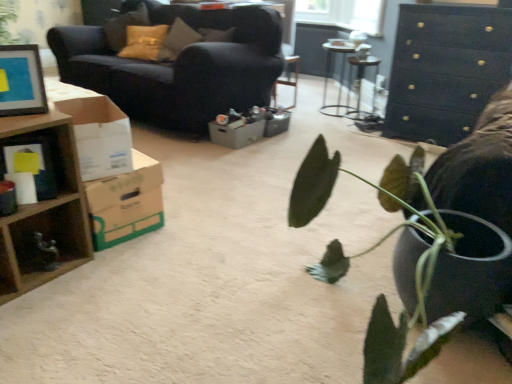
Question: From a real-world perspective, is gray cardboard box at center, the first cardboard box when ordered from back to front, positioned over metallic silver table at center, the 2th table positioned from the left, based on gravity?

Choices:
 (A) yes
 (B) no

Answer: (B)

Question: Considering the relative sizes of gray cardboard box at center, the first cardboard box when ordered from back to front, and metallic silver table at center, the 2th table positioned from the left, in the image provided, is gray cardboard box at center, the first cardboard box when ordered from back to front, shorter than metallic silver table at center, the 2th table positioned from the left,?

Choices:
 (A) no
 (B) yes

Answer: (B)

Question: Is gray cardboard box at center, which ranks as the third cardboard box in front-to-back order, next to metallic silver table at center, which ranks as the 1th table in right-to-left order, and touching it?

Choices:
 (A) yes
 (B) no

Answer: (B)

Question: Does gray cardboard box at center, the first cardboard box when ordered from back to front, lie behind metallic silver table at center, which ranks as the 1th table in right-to-left order?

Choices:
 (A) no
 (B) yes

Answer: (A)

Question: Can you confirm if gray cardboard box at center, which ranks as the third cardboard box in front-to-back order, is positioned to the right of metallic silver table at center, which ranks as the 1th table in right-to-left order?

Choices:
 (A) no
 (B) yes

Answer: (A)

Question: From a real-world perspective, is white cardboard box at left, the third cardboard box when ordered from back to front, positioned above or below matte black picture frame at upper left?

Choices:
 (A) above
 (B) below

Answer: (B)

Question: Considering the positions of white cardboard box at left, the third cardboard box when ordered from back to front, and matte black picture frame at upper left in the image, is white cardboard box at left, the third cardboard box when ordered from back to front, wider or thinner than matte black picture frame at upper left?

Choices:
 (A) thin
 (B) wide

Answer: (B)

Question: From the image's perspective, is white cardboard box at left, positioned as the first cardboard box in front-to-back order, positioned above or below matte black picture frame at upper left?

Choices:
 (A) above
 (B) below

Answer: (B)

Question: Is point (87, 178) closer or farther from the camera than point (20, 56)?

Choices:
 (A) closer
 (B) farther

Answer: (B)

Question: Would you say dark blue fabric couch at upper left is to the left or to the right of brown cardboard box at left, the second cardboard box in the front-to-back sequence, in the picture?

Choices:
 (A) left
 (B) right

Answer: (A)

Question: Considering the positions of dark blue fabric couch at upper left and brown cardboard box at left, the second cardboard box in the front-to-back sequence, in the image, is dark blue fabric couch at upper left bigger or smaller than brown cardboard box at left, the second cardboard box in the front-to-back sequence,?

Choices:
 (A) big
 (B) small

Answer: (A)

Question: From the image's perspective, is dark blue fabric couch at upper left positioned above or below brown cardboard box at left, the second cardboard box in the front-to-back sequence?

Choices:
 (A) above
 (B) below

Answer: (A)

Question: In the image, is dark blue fabric couch at upper left positioned in front of or behind brown cardboard box at left, the second cardboard box in the front-to-back sequence?

Choices:
 (A) behind
 (B) front

Answer: (A)

Question: In the image, is metallic silver table at center, which ranks as the 1th table in right-to-left order, positioned in front of or behind gray cardboard box at center, the first cardboard box when ordered from back to front?

Choices:
 (A) behind
 (B) front

Answer: (A)

Question: From a real-world perspective, relative to gray cardboard box at center, which ranks as the third cardboard box in front-to-back order, is metallic silver table at center, the 2th table positioned from the left, vertically above or below?

Choices:
 (A) above
 (B) below

Answer: (A)